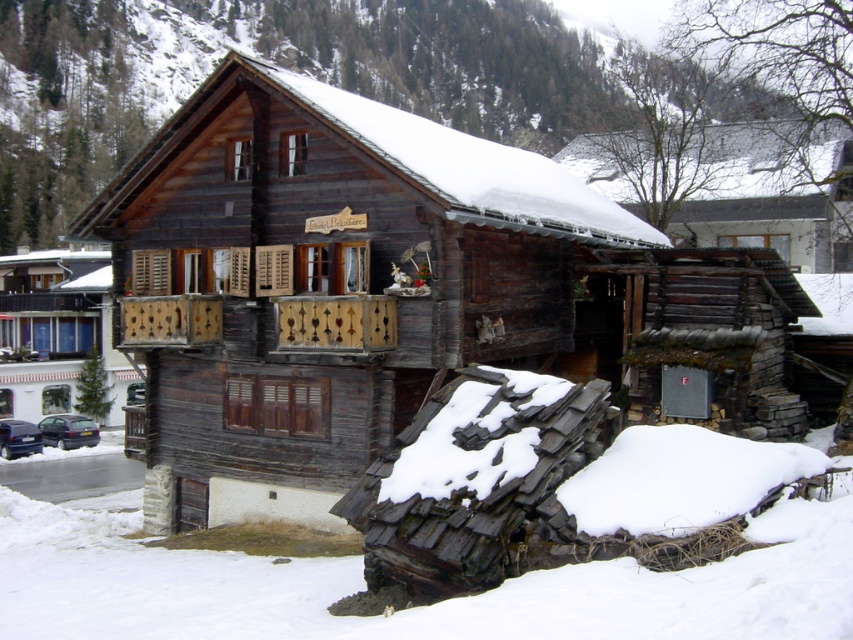
Question: Does shiny black car at lower left appear on the left side of dark blue metallic car at lower left?

Choices:
 (A) no
 (B) yes

Answer: (A)

Question: Which point is farther to the camera?

Choices:
 (A) wooden cabin at center
 (B) shiny black car at lower left
 (C) dark blue metallic car at lower left

Answer: (A)

Question: Is wooden cabin at center below dark blue metallic car at lower left?

Choices:
 (A) yes
 (B) no

Answer: (B)

Question: Considering the real-world distances, which object is farthest from the wooden cabin at center?

Choices:
 (A) dark blue metallic car at lower left
 (B) shiny black car at lower left

Answer: (A)

Question: Which of the following is the farthest from the observer?

Choices:
 (A) shiny black car at lower left
 (B) wooden cabin at center
 (C) dark blue metallic car at lower left

Answer: (B)

Question: In this image, where is wooden cabin at center located relative to dark blue metallic car at lower left?

Choices:
 (A) left
 (B) right

Answer: (A)